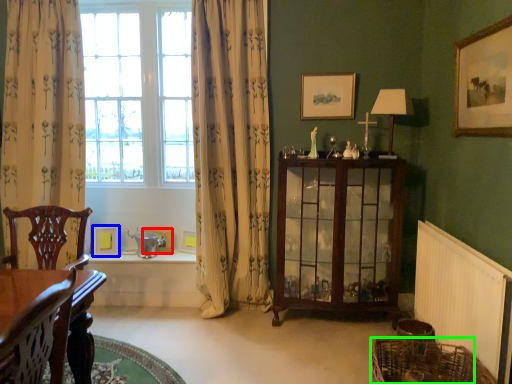
Question: Estimate the real-world distances between objects in this image. Which object is closer to picture frame (highlighted by a red box), picture frame (highlighted by a blue box) or basket (highlighted by a green box)?

Choices:
 (A) picture frame
 (B) basket

Answer: (A)